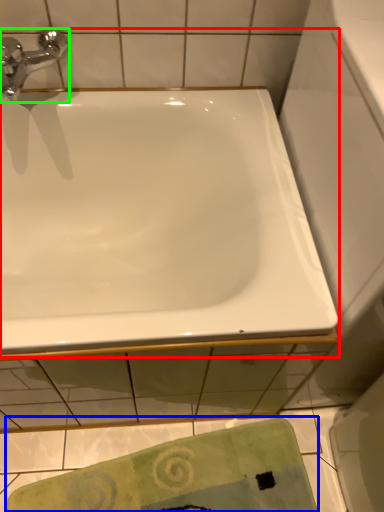
Question: Which object is the farthest from bathtub (highlighted by a red box)? Choose among these: beach towel (highlighted by a blue box) or tap (highlighted by a green box).

Choices:
 (A) beach towel
 (B) tap

Answer: (A)